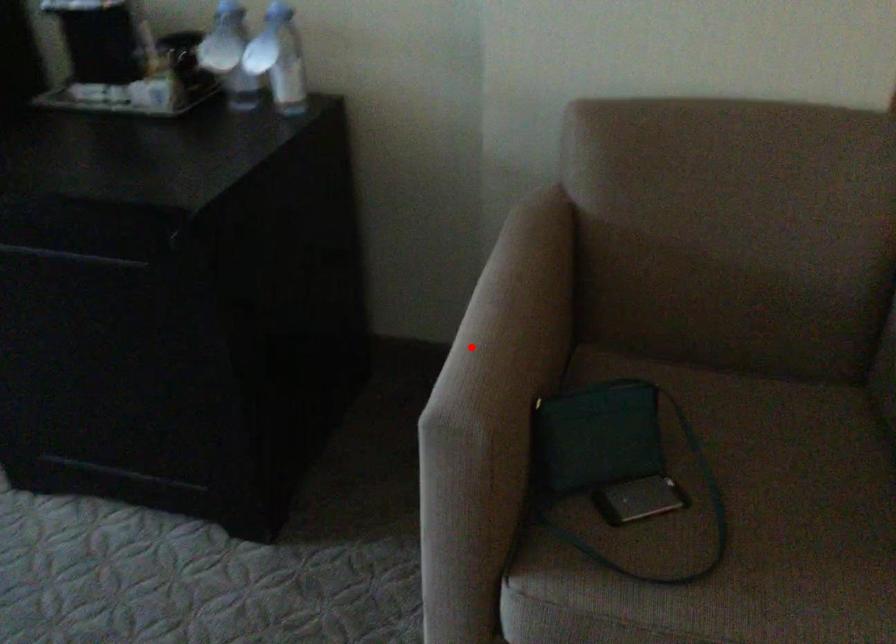
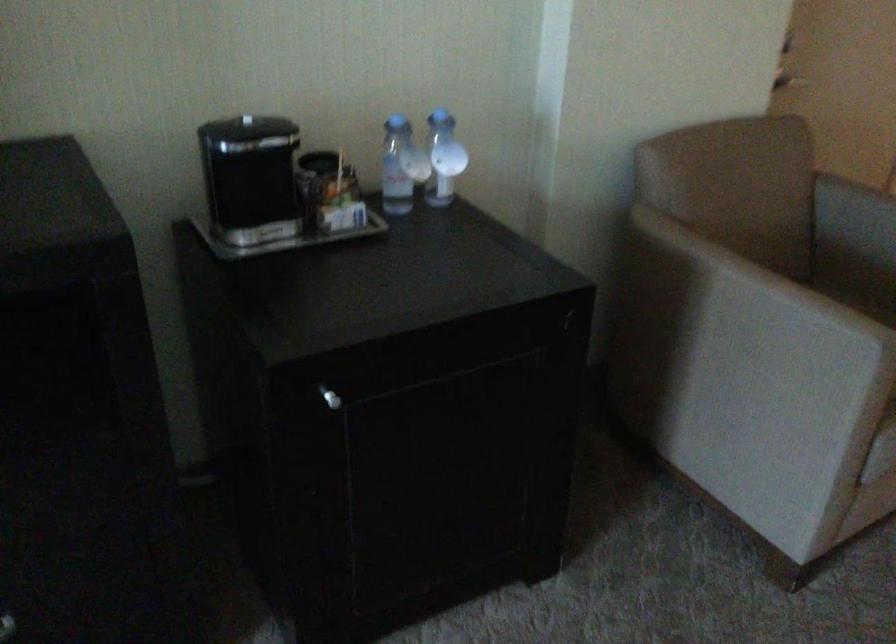
Find the pixel in the second image that matches the highlighted location in the first image.

(739, 319)